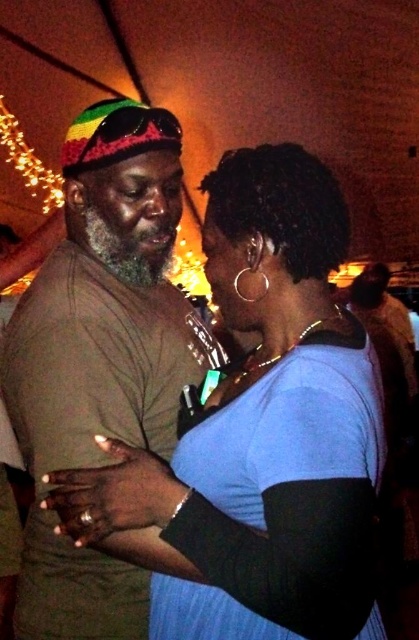
You are standing at the origin point in the scene. Which direction should you move to reach the blue matte shirt at center?

The blue matte shirt at center is located at coordinates point (261, 432), so you should move towards the right and forward to reach it.